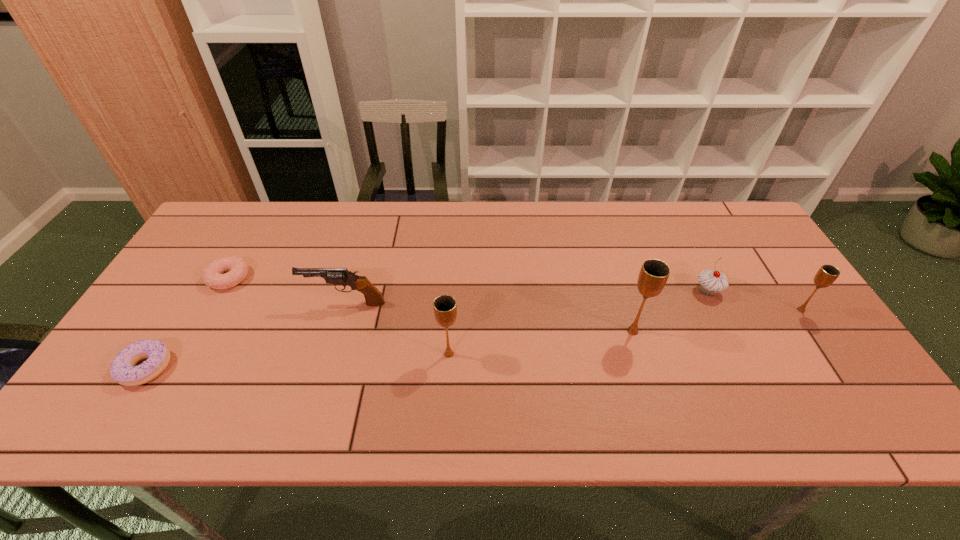
At what (x,y) coordinates should I click in order to perform the action: click on vacant space positioned 0.340m on the back of the second tallest object. Please return your answer as a coordinate pair (x, y). Looking at the image, I should click on (455, 254).

This screenshot has width=960, height=540. What are the coordinates of `vacant area situated 0.190m on the right of the second chalice from left to right` in the screenshot? It's located at (718, 331).

Where is `vacant area situated 0.250m on the left of the farthest chalice`? vacant area situated 0.250m on the left of the farthest chalice is located at coordinates (701, 310).

This screenshot has height=540, width=960. Identify the location of blank space located on the left of the sixth object from left to right. (583, 291).

The height and width of the screenshot is (540, 960). Find the location of `vacant space located 0.170m along the barrel of the fifth object from right to left`. vacant space located 0.170m along the barrel of the fifth object from right to left is located at coordinates (243, 303).

What are the coordinates of `vacant space located along the barrel of the fifth object from right to left` in the screenshot? It's located at (225, 303).

Locate an element on the screen. Image resolution: width=960 pixels, height=540 pixels. vacant region located along the barrel of the fifth object from right to left is located at coordinates (261, 303).

Find the location of `vacant space positioned 0.240m on the right of the farther doughnut`. vacant space positioned 0.240m on the right of the farther doughnut is located at coordinates (333, 278).

This screenshot has height=540, width=960. I want to click on blank space located on the back of the nearer doughnut, so click(x=207, y=269).

The image size is (960, 540). Find the location of `chalice that is positioned at the near edge`. chalice that is positioned at the near edge is located at coordinates (445, 309).